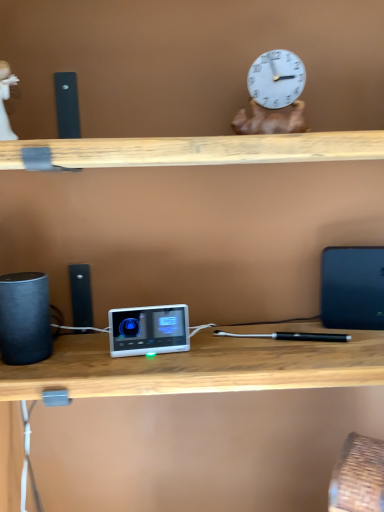
The width and height of the screenshot is (384, 512). What do you see at coordinates (352, 288) in the screenshot?
I see `blue matte laptop at right` at bounding box center [352, 288].

In order to face black matte speaker at left, should I rotate leftwards or rightwards?

It's best to rotate left around 21.720 degrees.

Find the location of a particular element. white porcelain figurine at upper left is located at coordinates (6, 99).

Is blue matte laptop at right positioned with its back to white plastic ipod at center?

That's not correct — blue matte laptop at right is not looking away from white plastic ipod at center.

Where is `ipod that is on the left side of blue matte laptop at right`? ipod that is on the left side of blue matte laptop at right is located at coordinates (148, 330).

Is blue matte laptop at right shorter than white plastic ipod at center?

In fact, blue matte laptop at right may be taller than white plastic ipod at center.

From the image's perspective, is blue matte laptop at right beneath white plastic ipod at center?

Actually, blue matte laptop at right appears above white plastic ipod at center in the image.

Is white plastic ipod at center smaller than white porcelain figurine at upper left?

No.

Find the location of a particular element. The image size is (384, 512). toy that is in front of the white plastic ipod at center is located at coordinates point(6,99).

From a real-world perspective, is white plastic ipod at center physically located above or below white porcelain figurine at upper left?

white plastic ipod at center is below white porcelain figurine at upper left.

From a real-world perspective, between black matte speaker at left and blue matte laptop at right, who is vertically lower?

In real-world perspective, black matte speaker at left is lower.

This screenshot has width=384, height=512. In order to click on speaker below the blue matte laptop at right (from the image's perspective) in this screenshot , I will do `click(24, 318)`.

Is black matte speaker at left to the right of blue matte laptop at right from the viewer's perspective?

Incorrect, black matte speaker at left is not on the right side of blue matte laptop at right.

From the image's perspective, which one is positioned higher, black matte speaker at left or blue matte laptop at right?

blue matte laptop at right appears higher in the image.

Can you tell me how much white porcelain figurine at upper left and blue matte laptop at right differ in facing direction?

They differ by 11.6 degrees in their facing directions.

From a real-world perspective, is white porcelain figurine at upper left positioned above or below blue matte laptop at right?

In terms of real-world spatial position, white porcelain figurine at upper left is above blue matte laptop at right.

In the scene shown: From the image's perspective, who appears lower, white porcelain figurine at upper left or blue matte laptop at right?

blue matte laptop at right appears lower in the image.

Can you confirm if blue matte laptop at right is thinner than white porcelain figurine at upper left?

Correct, the width of blue matte laptop at right is less than that of white porcelain figurine at upper left.

Is blue matte laptop at right aimed at white porcelain figurine at upper left?

No, blue matte laptop at right is not aimed at white porcelain figurine at upper left.

Is the position of blue matte laptop at right more distant than that of white porcelain figurine at upper left?

Yes, it is behind white porcelain figurine at upper left.

From a real-world perspective, is blue matte laptop at right beneath white porcelain figurine at upper left?

Yes, from a real-world perspective, blue matte laptop at right is below white porcelain figurine at upper left.

Which of these two, black matte speaker at left or white plastic ipod at center, is smaller?

black matte speaker at left.

From a real-world perspective, which is physically below, black matte speaker at left or white plastic ipod at center?

white plastic ipod at center, from a real-world perspective.

From the picture: Is black matte speaker at left beside white plastic ipod at center?

black matte speaker at left and white plastic ipod at center are not in contact.

Considering the relative positions of black matte speaker at left and white porcelain figurine at upper left in the image provided, is black matte speaker at left to the left of white porcelain figurine at upper left from the viewer's perspective?

Incorrect, black matte speaker at left is not on the left side of white porcelain figurine at upper left.

From a real-world perspective, is black matte speaker at left positioned above or below white porcelain figurine at upper left?

Clearly, from a real-world perspective, black matte speaker at left is below white porcelain figurine at upper left.

From the image's perspective, which is below, black matte speaker at left or white porcelain figurine at upper left?

black matte speaker at left.

In order to click on ipod below the blue matte laptop at right (from a real-world perspective) in this screenshot , I will do (x=148, y=330).

You are a GUI agent. You are given a task and a screenshot of the screen. Output one action in this format:
    pyautogui.click(x=<x>, y=<y>)
    Task: Click on the toy located above the white plastic ipod at center (from a real-world perspective)
    The image size is (384, 512).
    Given the screenshot: What is the action you would take?
    pyautogui.click(x=6, y=99)

Based on their spatial positions, is black matte speaker at left or white plastic ipod at center closer to white porcelain figurine at upper left?

black matte speaker at left.

Based on their spatial positions, is white porcelain figurine at upper left or black matte speaker at left further from blue matte laptop at right?

The object further to blue matte laptop at right is white porcelain figurine at upper left.

Estimate the real-world distances between objects in this image. Which object is further from black matte speaker at left, blue matte laptop at right or white porcelain figurine at upper left?

blue matte laptop at right is positioned further to the anchor black matte speaker at left.

Looking at the image, which one is located further to blue matte laptop at right, black matte speaker at left or white porcelain figurine at upper left?

The object further to blue matte laptop at right is white porcelain figurine at upper left.

Looking at this image, estimate the real-world distances between objects in this image. Which object is closer to white plastic ipod at center, white porcelain figurine at upper left or blue matte laptop at right?

Among the two, blue matte laptop at right is located nearer to white plastic ipod at center.

From the picture: Considering their positions, is white plastic ipod at center positioned further to black matte speaker at left than white porcelain figurine at upper left?

Among the two, white porcelain figurine at upper left is located further to black matte speaker at left.

Considering their positions, is blue matte laptop at right positioned closer to white plastic ipod at center than white porcelain figurine at upper left?

blue matte laptop at right.

When comparing their distances from white porcelain figurine at upper left, does black matte speaker at left or blue matte laptop at right seem further?

Based on the image, blue matte laptop at right appears to be further to white porcelain figurine at upper left.

This screenshot has height=512, width=384. In order to click on ipod between white porcelain figurine at upper left and blue matte laptop at right in this screenshot , I will do `click(148, 330)`.

You are a GUI agent. You are given a task and a screenshot of the screen. Output one action in this format:
    pyautogui.click(x=<x>, y=<y>)
    Task: Click on the ipod between black matte speaker at left and blue matte laptop at right in the horizontal direction
    The width and height of the screenshot is (384, 512).
    Given the screenshot: What is the action you would take?
    pyautogui.click(x=148, y=330)

You are a GUI agent. You are given a task and a screenshot of the screen. Output one action in this format:
    pyautogui.click(x=<x>, y=<y>)
    Task: Click on the speaker between white porcelain figurine at upper left and white plastic ipod at center from top to bottom
    
    Given the screenshot: What is the action you would take?
    pyautogui.click(x=24, y=318)

The width and height of the screenshot is (384, 512). What are the coordinates of `speaker located between white porcelain figurine at upper left and blue matte laptop at right in the left-right direction` in the screenshot? It's located at (24, 318).